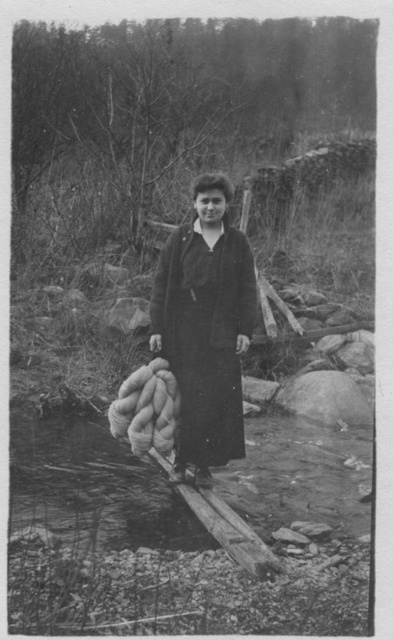
Question: Among these points, which one is farthest from the camera?

Choices:
 (A) (216, 442)
 (B) (330, 496)

Answer: (B)

Question: Does smooth stone stream at center have a smaller size compared to dark wool coat at center?

Choices:
 (A) yes
 (B) no

Answer: (B)

Question: Does smooth stone stream at center appear on the left side of dark wool coat at center?

Choices:
 (A) yes
 (B) no

Answer: (A)

Question: In this image, where is smooth stone stream at center located relative to dark wool coat at center?

Choices:
 (A) right
 (B) left

Answer: (B)